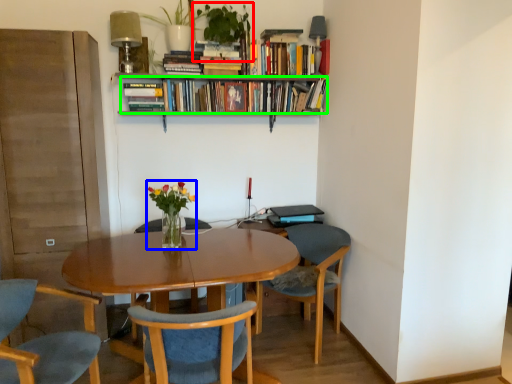
Question: Based on their relative distances, which object is nearer to houseplant (highlighted by a red box)? Choose from floral arrangement (highlighted by a blue box) and book (highlighted by a green box).

Choices:
 (A) floral arrangement
 (B) book

Answer: (B)